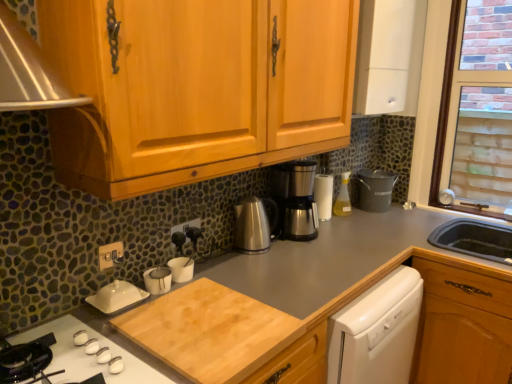
Question: From a real-world perspective, relative to gold metallic switch at lower left, the 1th electric outlet viewed from the left, is white glossy gas stove at lower left vertically above or below?

Choices:
 (A) above
 (B) below

Answer: (B)

Question: Considering their positions, is white glossy gas stove at lower left located in front of or behind gold metallic switch at lower left, the 2th electric outlet positioned from the back?

Choices:
 (A) front
 (B) behind

Answer: (A)

Question: Which object is the farthest from the brown wood drawer at lower right?

Choices:
 (A) metallic silver coffee maker at right
 (B) gold metallic switch at lower left, arranged as the 2th electric outlet when viewed from the right
 (C) satin silver coffee machine at center
 (D) satin silver coffee pot at center
 (E) black plastic electric outlet at center, the first electric outlet viewed from the right

Answer: (B)

Question: Which of these objects is positioned closest to the metallic silver coffee maker at right?

Choices:
 (A) satin silver coffee pot at center
 (B) satin silver coffee machine at center
 (C) translucent plastic spray bottle at center-right
 (D) white glossy gas stove at lower left
 (E) natural wood cutting board at lower center

Answer: (C)